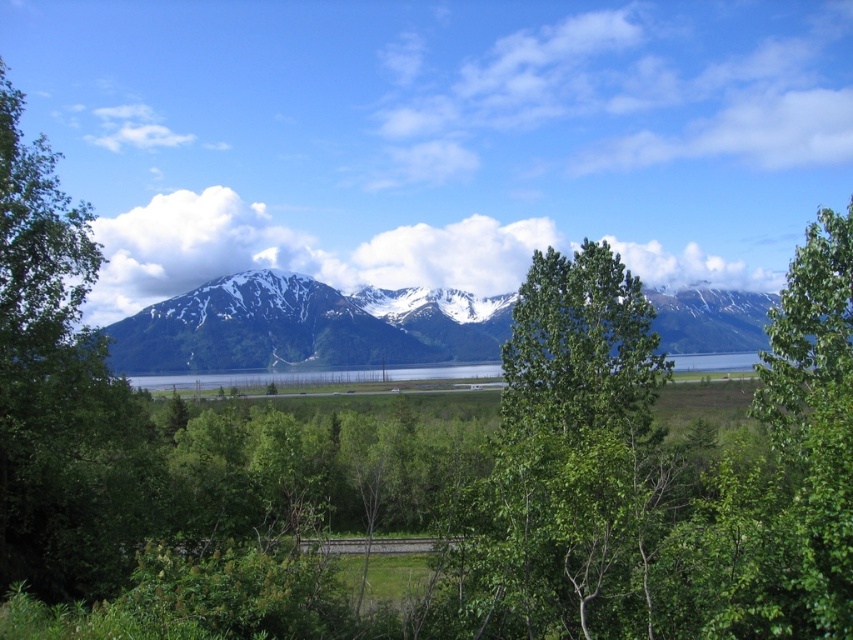
You are planning to set up a tent for a camping trip. You want to place it near the green leafy tree at center so you can enjoy the shade, but also want to have a clear view of the snowy rocky mountain range at center. Given the distance between them, is it possible to set up the tent in such a way that both the tree and the mountain range are visible from the tent site?

The green leafy tree at center and snowy rocky mountain range at center are 134.08 meters apart. Since the distance is quite large, you can set up the tent near the tree and still have a clear view of the mountain range as they are not obstructed by any objects mentioned in the scene.

You are standing at the point labeled point [212,353] and want to walk towards the mountains in the background. Is the point labeled point [552,368] located between you and the mountains?

Yes, the point labeled point [552,368] is between you and the mountains because it is closer to the camera than point [212,353], which means it is in front of your current position.

From the picture: What is the exact coordinate of the snowy rocky mountain range at center?

The snowy rocky mountain range at center is located at point (305, 326).